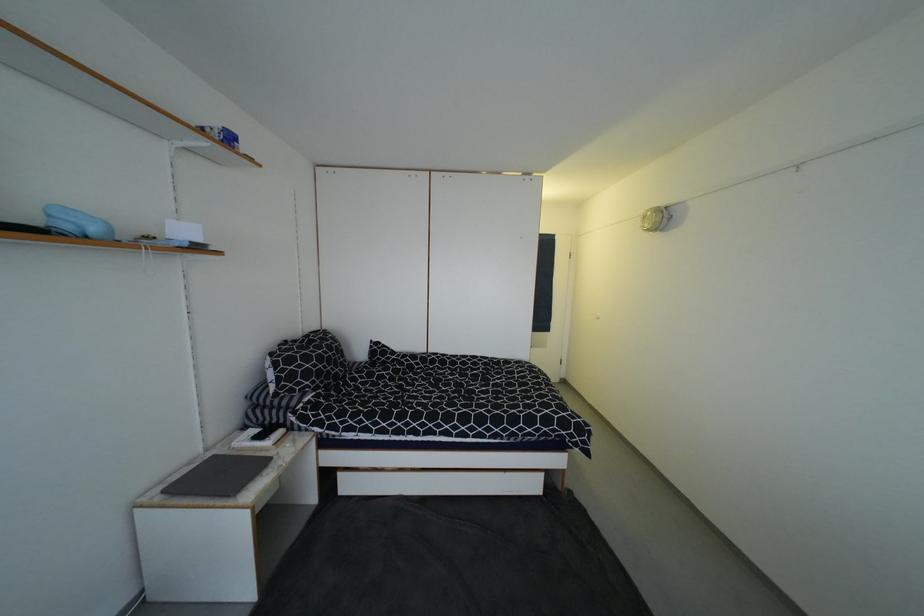
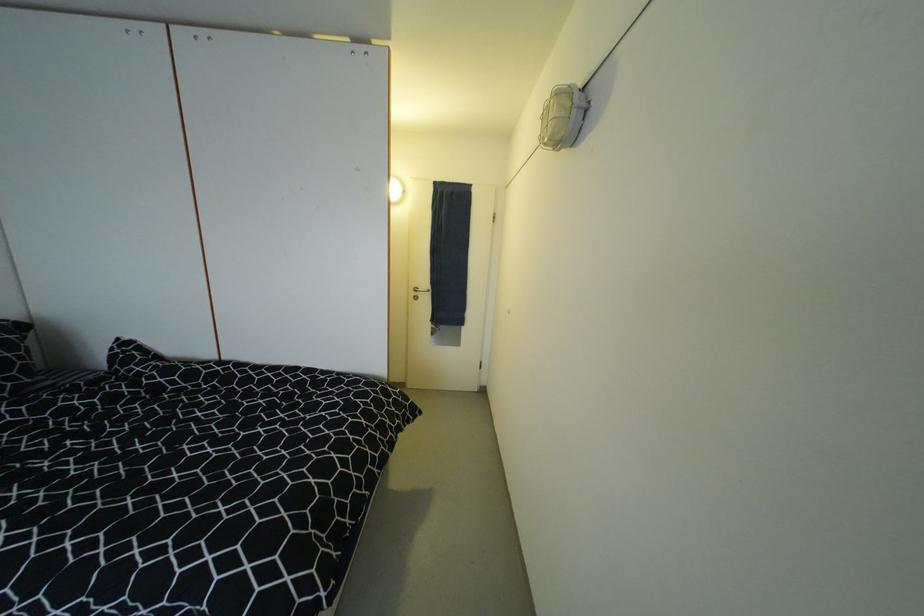
What movement of the cameraman would produce the second image?

The cameraman walked toward right, forward.